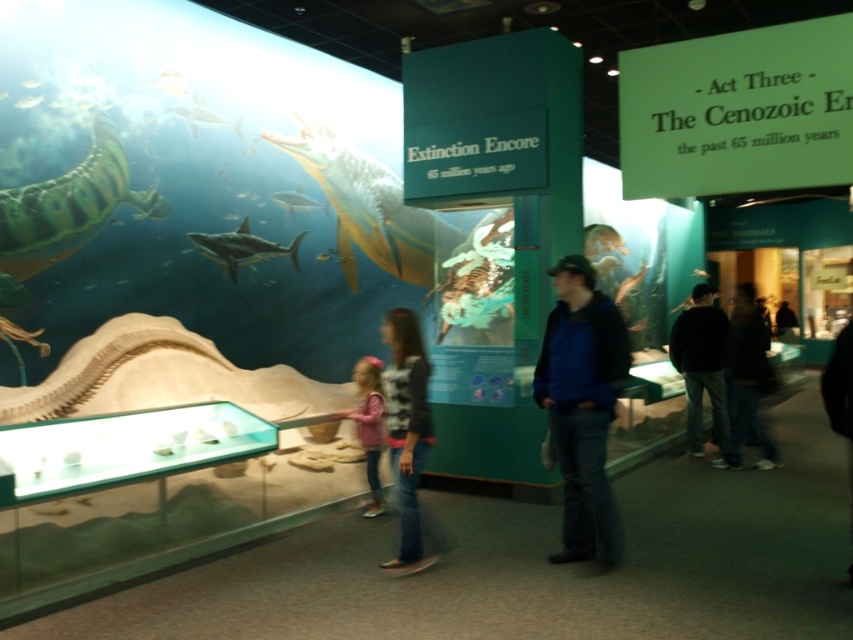
You are a visitor at the museum and see the black matte jacket at center and the translucent white shark at upper center. Which object is located more to the right side?

The black matte jacket at center is positioned on the right side of the translucent white shark at upper center, so it is more to the right.

You are a museum visitor who wants to take a photo of the shiny silver shark at center and the shiny silver fish at upper left. Which object should you focus on first if you want to capture both in a single frame without moving the camera?

You should focus on the shiny silver shark at center first because it is larger than the shiny silver fish at upper left, allowing it to be more prominent in the frame while still including the smaller fish in the background.